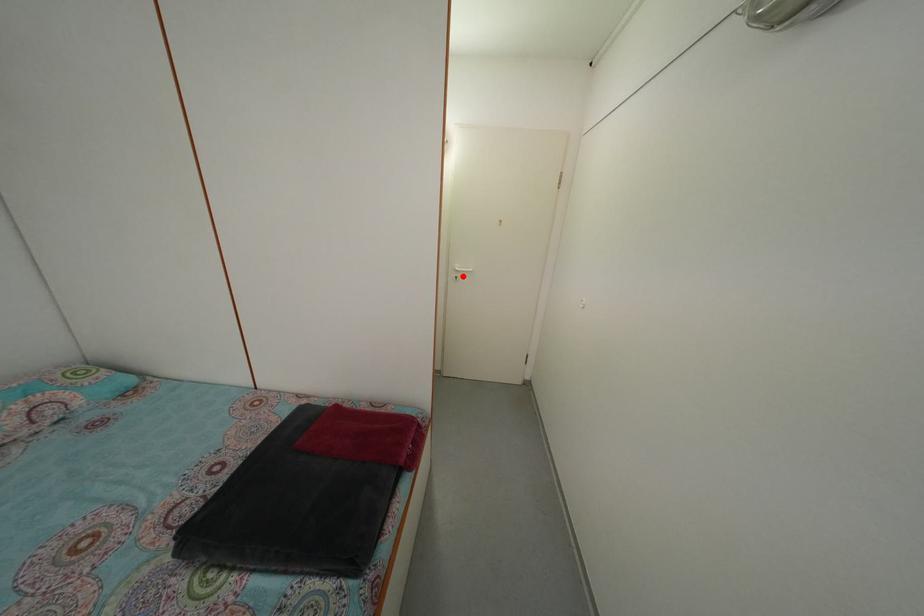
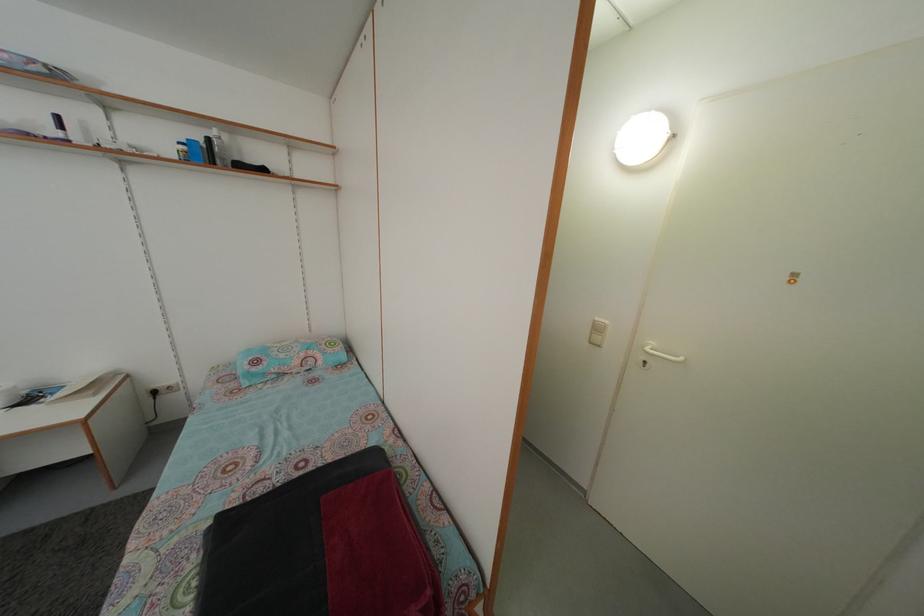
Question: I am providing you with two images of the same scene from different viewpoints. A red point is marked on the first image. At the location where the point appears in image 1, is it still visible in image 2?

Choices:
 (A) Yes
 (B) No

Answer: (A)